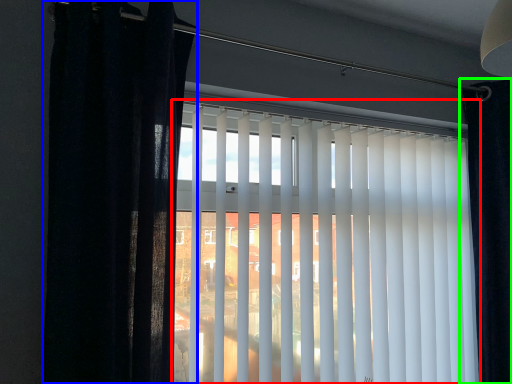
Question: Which is nearer to the window blind (highlighted by a red box)? curtain (highlighted by a blue box) or curtain (highlighted by a green box).

Choices:
 (A) curtain
 (B) curtain

Answer: (A)